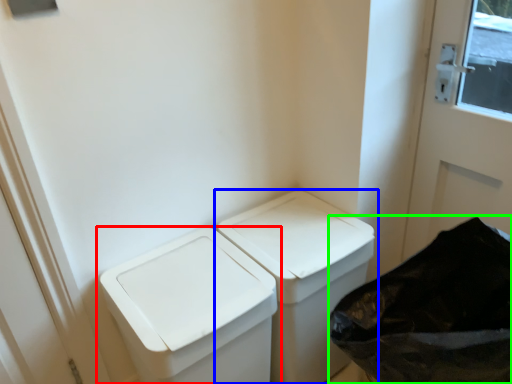
Question: Based on their relative distances, which object is farther from waste container (highlighted by a red box)? Choose from waste container (highlighted by a blue box) and recycling bin (highlighted by a green box).

Choices:
 (A) waste container
 (B) recycling bin

Answer: (B)